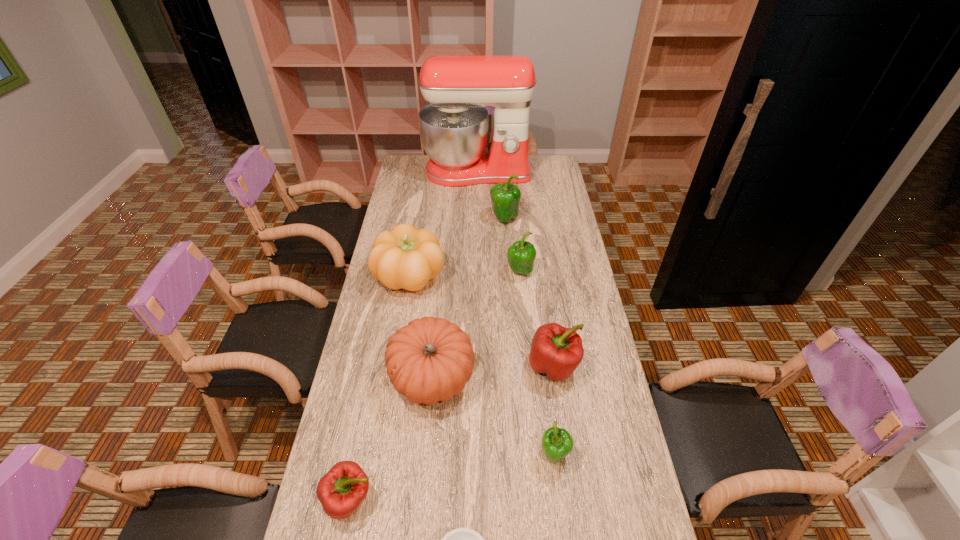
Where is `pink mixer`? The image size is (960, 540). pink mixer is located at coordinates (454, 126).

Locate an element on the screen. This screenshot has width=960, height=540. the tallest object is located at coordinates (454, 126).

In order to click on the second farthest object in this screenshot , I will do `click(505, 198)`.

You are a GUI agent. You are given a task and a screenshot of the screen. Output one action in this format:
    pyautogui.click(x=<x>, y=<y>)
    Task: Click on the biggest green bell pepper
    Image resolution: width=960 pixels, height=540 pixels.
    Given the screenshot: What is the action you would take?
    pyautogui.click(x=505, y=198)

The height and width of the screenshot is (540, 960). Identify the location of the farther pumpkin. pyautogui.click(x=405, y=257).

Where is `the nearer pumpkin`? Image resolution: width=960 pixels, height=540 pixels. the nearer pumpkin is located at coordinates (431, 359).

Where is `orange pumpkin`? This screenshot has width=960, height=540. orange pumpkin is located at coordinates (431, 359).

The image size is (960, 540). What are the coordinates of `the second nearest green bell pepper` in the screenshot? It's located at (521, 255).

Locate an element on the screen. Image resolution: width=960 pixels, height=540 pixels. the fourth nearest bell pepper is located at coordinates (521, 255).

The height and width of the screenshot is (540, 960). I want to click on the right pink bell pepper, so click(557, 351).